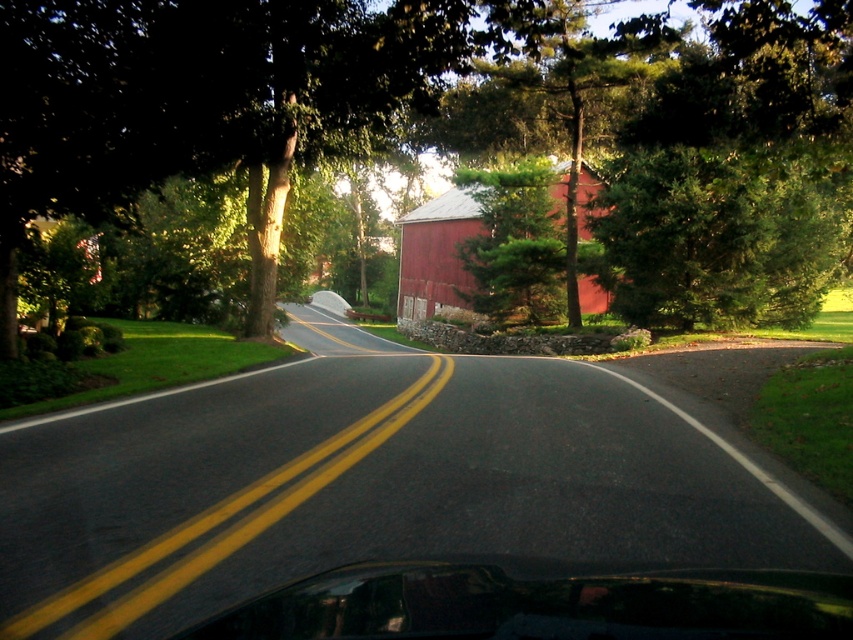
Which is in front, point (131, 138) or point (454, 204)?

Positioned in front is point (131, 138).

Does green leafy tree at upper center have a greater width compared to smooth red barn at center?

Yes, green leafy tree at upper center is wider than smooth red barn at center.

Is point (749, 17) farther from viewer compared to point (587, 294)?

No.

Locate an element on the screen. The width and height of the screenshot is (853, 640). green leafy tree at upper center is located at coordinates (213, 99).